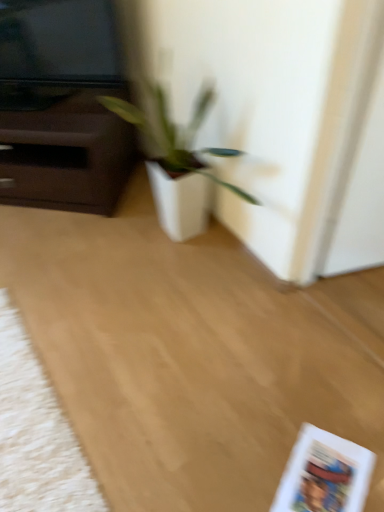
Where is `white fluffy mat at lower left`? This screenshot has width=384, height=512. white fluffy mat at lower left is located at coordinates (36, 433).

Image resolution: width=384 pixels, height=512 pixels. In order to click on white fluffy mat at lower left in this screenshot , I will do `click(36, 433)`.

In the scene shown: Is white fluffy mat at lower left oriented away from white matte plant pot at center?

No, white fluffy mat at lower left is not facing away from white matte plant pot at center.

From the image's perspective, who appears lower, white fluffy mat at lower left or white matte plant pot at center?

white fluffy mat at lower left.

Is white fluffy mat at lower left situated inside white matte plant pot at center or outside?

The correct answer is: inside.

Considering the positions of objects white fluffy mat at lower left and white matte plant pot at center in the image provided, who is more to the left, white fluffy mat at lower left or white matte plant pot at center?

white fluffy mat at lower left.

How different are the orientations of white matte pot at center and white matte paperback book at lower right in degrees?

There is a 28.7-degree angle between the facing directions of white matte pot at center and white matte paperback book at lower right.

Is white matte pot at center in contact with white matte paperback book at lower right?

white matte pot at center and white matte paperback book at lower right are not in contact.

Is white matte pot at center looking in the opposite direction of white matte paperback book at lower right?

No.

Is white matte plant pot at center aimed at white fluffy mat at lower left?

No, white matte plant pot at center is not aimed at white fluffy mat at lower left.

Could white fluffy mat at lower left be considered to be inside white matte plant pot at center?

Absolutely, white fluffy mat at lower left is inside white matte plant pot at center.

Identify the location of plain that appears in front of the white fluffy mat at lower left. The height and width of the screenshot is (512, 384). (192, 355).

Does white matte plant pot at center have a greater width compared to white fluffy mat at lower left?

Correct, the width of white matte plant pot at center exceeds that of white fluffy mat at lower left.

What are the coordinates of `houseplant lying behind the white matte plant pot at center` in the screenshot? It's located at pos(177,163).

Considering the positions of objects white matte pot at center and white matte plant pot at center in the image provided, who is in front, white matte pot at center or white matte plant pot at center?

white matte plant pot at center is closer to the camera.

Is white matte pot at center bigger or smaller than white matte plant pot at center?

Considering their sizes, white matte pot at center takes up less space than white matte plant pot at center.

Does point (8, 399) come farther from viewer compared to point (363, 475)?

Yes, it is behind point (363, 475).

Is the depth of white fluffy mat at lower left less than that of white matte paperback book at lower right?

Yes, white fluffy mat at lower left is closer to the viewer.

Between white fluffy mat at lower left and white matte paperback book at lower right, which one has larger size?

white fluffy mat at lower left.

Is white fluffy mat at lower left facing towards white matte paperback book at lower right?

No, white fluffy mat at lower left is not turned towards white matte paperback book at lower right.

Which of these two, white matte pot at center or white fluffy mat at lower left, is bigger?

white matte pot at center is bigger.

Is white matte pot at center next to white fluffy mat at lower left and touching it?

There is a gap between white matte pot at center and white fluffy mat at lower left.

Is white matte pot at center oriented towards white fluffy mat at lower left?

Yes.

Which object is positioned more to the left, white matte pot at center or white fluffy mat at lower left?

white fluffy mat at lower left is more to the left.

From the image's perspective, is white matte plant pot at center positioned above or below white matte pot at center?

From the image's perspective, white matte plant pot at center appears below white matte pot at center.

Considering the sizes of objects white matte plant pot at center and white matte pot at center in the image provided, who is thinner, white matte plant pot at center or white matte pot at center?

white matte pot at center is thinner.

Can you confirm if white matte plant pot at center is taller than white matte pot at center?

In fact, white matte plant pot at center may be shorter than white matte pot at center.

Can we say white matte plant pot at center lies outside white matte pot at center?

Yes, white matte plant pot at center is outside of white matte pot at center.

The width and height of the screenshot is (384, 512). I want to click on mat that is above the white matte plant pot at center (from a real-world perspective), so click(x=36, y=433).

The image size is (384, 512). What are the coordinates of `houseplant that appears behind the white matte paperback book at lower right` in the screenshot? It's located at (177, 163).

Considering their positions, is white matte paperback book at lower right positioned closer to white fluffy mat at lower left than white matte plant pot at center?

white matte plant pot at center lies closer to white fluffy mat at lower left than the other object.

In the scene shown: Based on their spatial positions, is white matte paperback book at lower right or white matte plant pot at center closer to white matte pot at center?

Among the two, white matte plant pot at center is located nearer to white matte pot at center.

Considering their positions, is white matte plant pot at center positioned further to white fluffy mat at lower left than white matte pot at center?

white matte pot at center is positioned further to the anchor white fluffy mat at lower left.

When comparing their distances from white matte plant pot at center, does white matte paperback book at lower right or white matte pot at center seem further?

white matte pot at center lies further to white matte plant pot at center than the other object.

Based on their spatial positions, is white fluffy mat at lower left or white matte pot at center closer to white matte plant pot at center?

white fluffy mat at lower left is closer to white matte plant pot at center.

From the image, which object appears to be farther from white matte plant pot at center, white matte pot at center or white fluffy mat at lower left?

white matte pot at center.

Looking at this image, considering their positions, is white matte plant pot at center positioned further to white matte paperback book at lower right than white matte pot at center?

Among the two, white matte pot at center is located further to white matte paperback book at lower right.

Looking at the image, which one is located further to white matte paperback book at lower right, white matte plant pot at center or white fluffy mat at lower left?

white fluffy mat at lower left is positioned further to the anchor white matte paperback book at lower right.

The width and height of the screenshot is (384, 512). What are the coordinates of `houseplant between white fluffy mat at lower left and white matte paperback book at lower right` in the screenshot? It's located at (177, 163).

Locate an element on the screen. plain between white fluffy mat at lower left and white matte paperback book at lower right in the horizontal direction is located at coordinates (192, 355).

The image size is (384, 512). What are the coordinates of `plain between white matte pot at center and white fluffy mat at lower left in the up-down direction` in the screenshot? It's located at (192, 355).

This screenshot has height=512, width=384. Find the location of `plain between white matte pot at center and white matte paperback book at lower right vertically`. plain between white matte pot at center and white matte paperback book at lower right vertically is located at coordinates (192, 355).